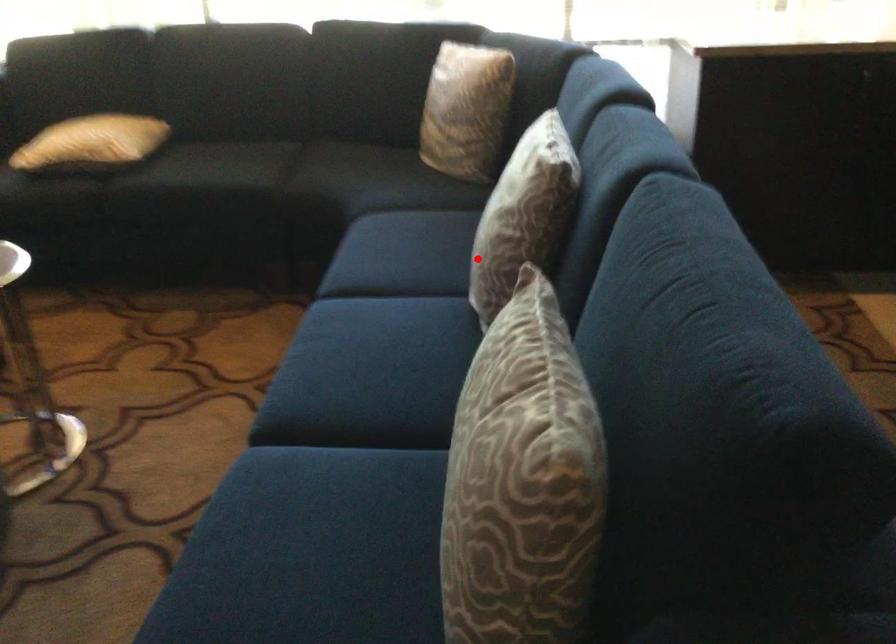
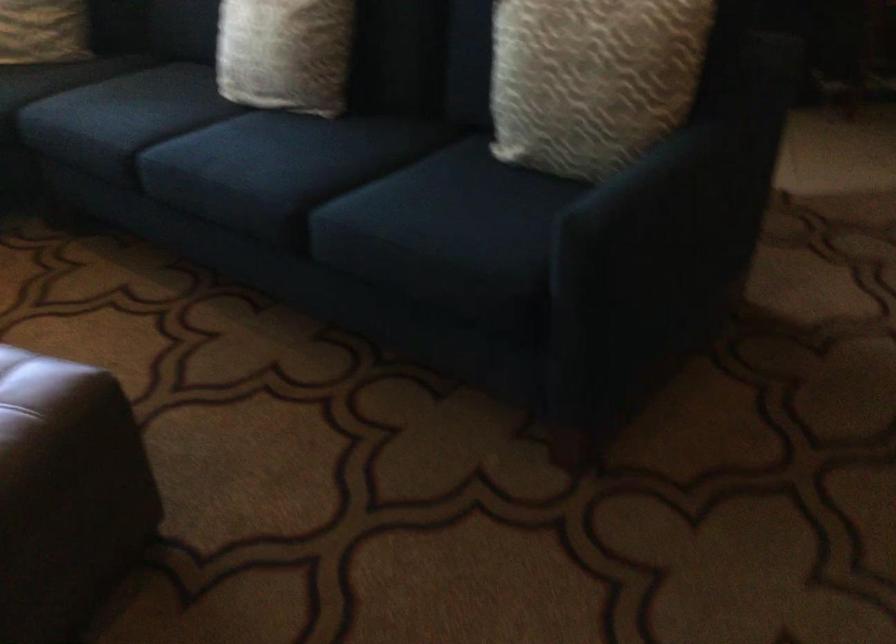
Question: I am providing you with two images of the same scene from different viewpoints. In image1, a red point is highlighted. Considering the same 3D point in image2, which of the following is correct?

Choices:
 (A) It is closer
 (B) It is farther

Answer: (B)